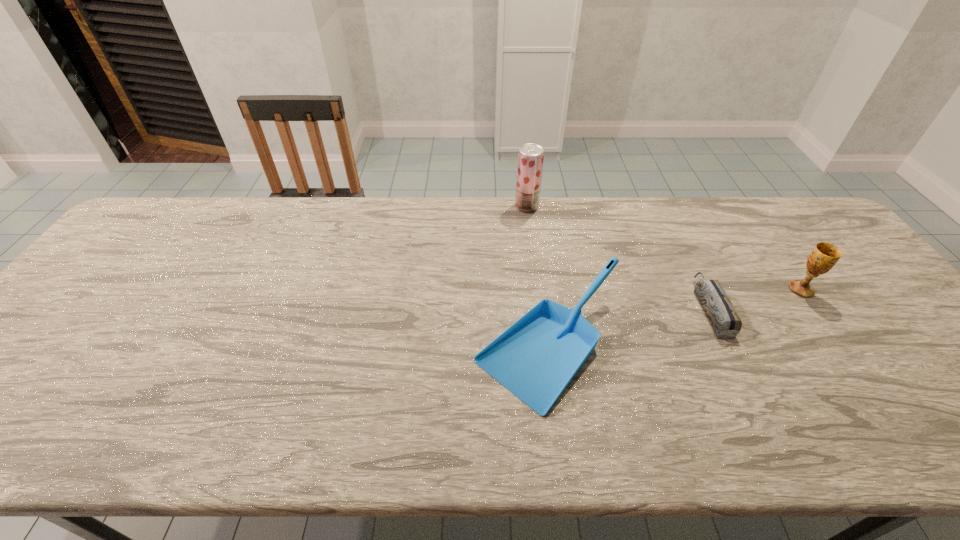
What are the coordinates of `unoccupied position between the tallest object and the dustpan` in the screenshot? It's located at (538, 275).

Locate an element on the screen. free space that is in between the rightmost object and the dustpan is located at coordinates (x=675, y=317).

Locate an element on the screen. The height and width of the screenshot is (540, 960). free space between the dustpan and the tallest object is located at coordinates (538, 275).

Where is `free spot between the fruit juice and the dustpan`? Image resolution: width=960 pixels, height=540 pixels. free spot between the fruit juice and the dustpan is located at coordinates (538, 275).

This screenshot has height=540, width=960. In order to click on vacant region between the dustpan and the farthest object in this screenshot , I will do `click(538, 275)`.

Locate an element on the screen. This screenshot has width=960, height=540. free space between the rightmost object and the farthest object is located at coordinates (663, 248).

Point out which object is positioned as the third nearest to the rightmost object. Please provide its 2D coordinates. Your answer should be formatted as a tuple, i.e. [(x, y)], where the tuple contains the x and y coordinates of a point satisfying the conditions above.

[(530, 156)]

Select which object is the third closest to the rightmost object. Please provide its 2D coordinates. Your answer should be formatted as a tuple, i.e. [(x, y)], where the tuple contains the x and y coordinates of a point satisfying the conditions above.

[(530, 156)]

Where is `free point that satisfies the following two spatial constraints: 1. on the front side of the third tallest object; 2. on the left side of the tallest object`? Image resolution: width=960 pixels, height=540 pixels. free point that satisfies the following two spatial constraints: 1. on the front side of the third tallest object; 2. on the left side of the tallest object is located at coordinates (544, 345).

Find the location of a particular element. This screenshot has height=540, width=960. blank space that satisfies the following two spatial constraints: 1. on the back side of the third tallest object; 2. on the right side of the chalice is located at coordinates (542, 289).